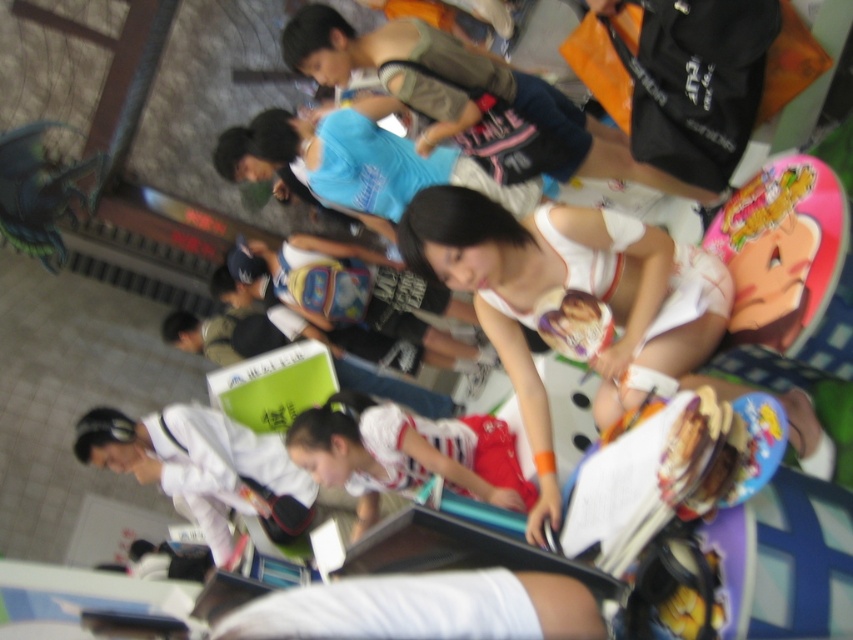
You are a photographer trying to capture a clear shot of the white fabric tank top at center and the white striped shirt at center in the blurred scene. Which one is closer to the camera lens?

The white fabric tank top at center is in front of the white striped shirt at center, so it is closer to the camera lens.

Looking at this image, you are a photographer trying to capture a clear shot of both the white fabric tank top at center and the white striped shirt at center in the blurred image. Since the scene is motion blurred, which clothing item might be easier to focus on due to its position?

The white fabric tank top at center is located above the white striped shirt at center, so it might be easier to focus on the white fabric tank top at center since it is higher up and possibly less affected by the motion blur caused by vertical movement.

Based on the scene description, where is the white fabric tank top at center located in the image?

The white fabric tank top at center is located at point [576,289] in the image.